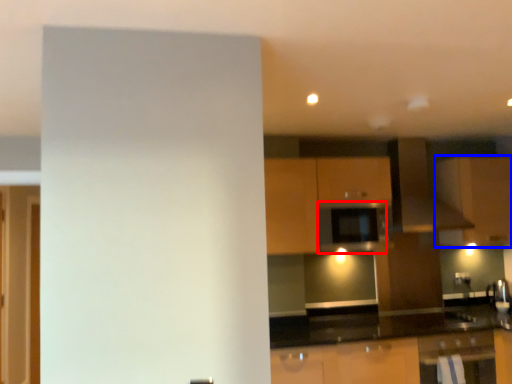
Question: Which object is closer to the camera taking this photo, appliance (highlighted by a red box) or cabinetry (highlighted by a blue box)?

Choices:
 (A) appliance
 (B) cabinetry

Answer: (A)